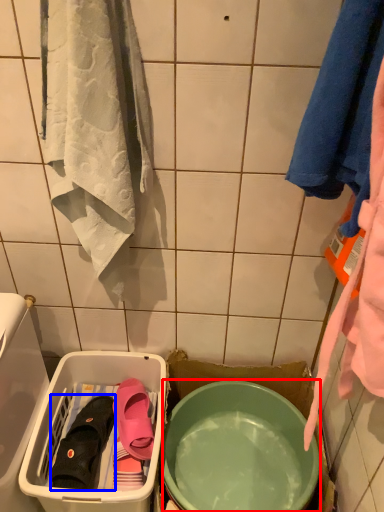
Question: Which point is further to the camera, mixing bowl (highlighted by a red box) or footwear (highlighted by a blue box)?

Choices:
 (A) mixing bowl
 (B) footwear

Answer: (B)